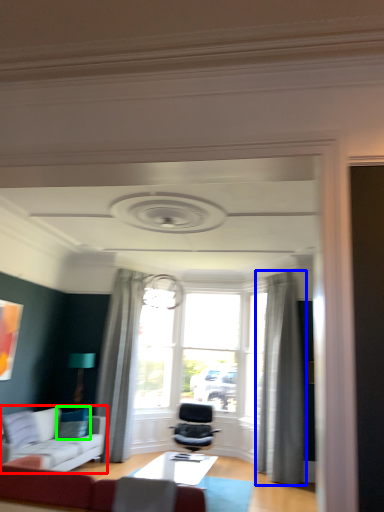
Question: Considering the real-world distances, which object is closest to studio couch (highlighted by a red box)? curtain (highlighted by a blue box) or pillow (highlighted by a green box).

Choices:
 (A) curtain
 (B) pillow

Answer: (B)